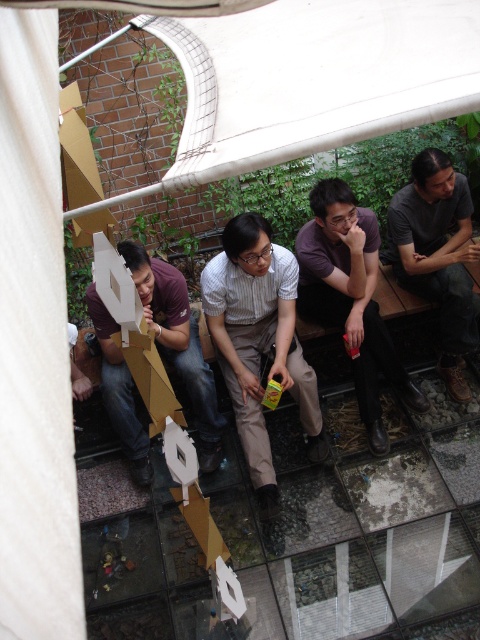
Is point (228, 44) positioned before point (324, 180)?

That is True.

Where is `white fabric canopy at upper center`? This screenshot has height=640, width=480. white fabric canopy at upper center is located at coordinates (314, 77).

This screenshot has width=480, height=640. What are the coordinates of `white fabric canopy at upper center` in the screenshot? It's located at (314, 77).

Where is `white fabric canopy at upper center`? The image size is (480, 640). white fabric canopy at upper center is located at coordinates (314, 77).

Who is shorter, purple matte shirt at center or dark gray shirt at right?

dark gray shirt at right is shorter.

Who is more distant from viewer, (337, 228) or (402, 268)?

Point (402, 268)

What do you see at coordinates (350, 298) in the screenshot? This screenshot has width=480, height=640. I see `purple matte shirt at center` at bounding box center [350, 298].

At what (x,y) coordinates should I click in order to perform the action: click on purple matte shirt at center. Please return your answer as a coordinate pair (x, y). Looking at the image, I should click on (350, 298).

Which is more to the left, purple matte shirt at center or matte cardboard box at lower left?

matte cardboard box at lower left is more to the left.

Which is behind, point (335, 236) or point (169, 330)?

The point (335, 236) is behind.

This screenshot has width=480, height=640. Identify the location of purple matte shirt at center. (350, 298).